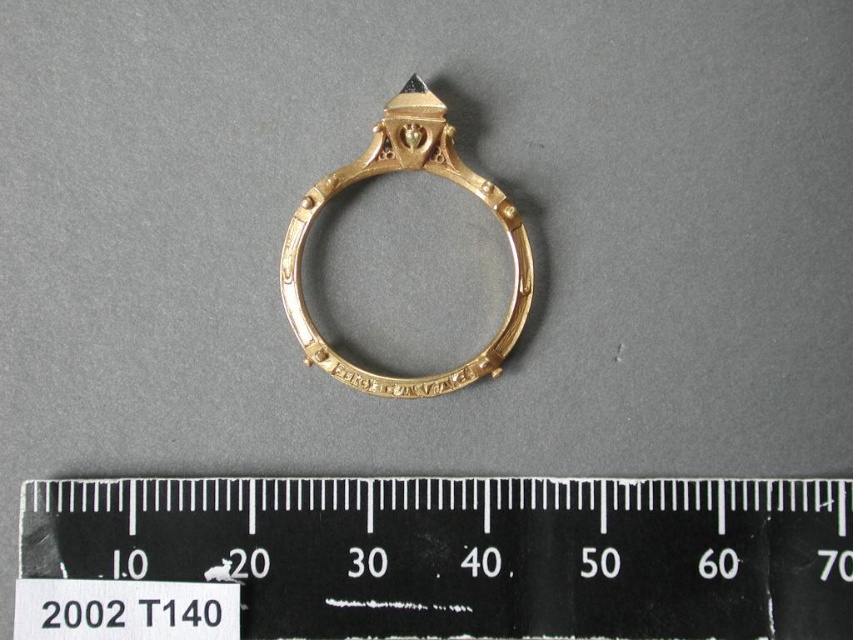
Question: Observing the image, what is the correct spatial positioning of black plastic ruler at bottom in reference to gold/yellow metal ring at center?

Choices:
 (A) left
 (B) right

Answer: (B)

Question: Which point appears closest to the camera in this image?

Choices:
 (A) (840, 620)
 (B) (283, 269)

Answer: (A)

Question: Considering the relative positions of black plastic ruler at bottom and gold/yellow metal ring at center in the image provided, where is black plastic ruler at bottom located with respect to gold/yellow metal ring at center?

Choices:
 (A) left
 (B) right

Answer: (B)

Question: Can you confirm if black plastic ruler at bottom is positioned to the left of gold/yellow metal ring at center?

Choices:
 (A) yes
 (B) no

Answer: (B)